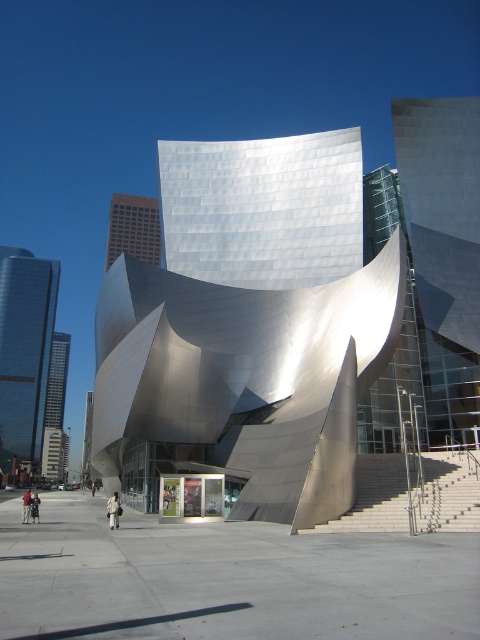
You are a photographer standing in the plaza and want to capture both the light brown leather jacket at center and the dark gray fabric jacket at lower left in the same frame. Which jacket should you position closer to the left side of your camera viewfinder to include both?

To include both jackets in the frame, position the light brown leather jacket at center closer to the left side of your camera viewfinder since it is already to the left of the dark gray fabric jacket at lower left.

You are standing at the plaza in front of the building and want to reach the entrance located at point (110, 520). There is an obstacle at point (43, 310). Will you have to go around the obstacle to reach the entrance?

Point (43, 310) is behind point (110, 520), so you will not encounter the obstacle at point (43, 310) while moving towards the entrance at point (110, 520). You can proceed directly to the entrance without needing to go around.

You are planning to take a photo of the shiny glass skyscraper at left and want to include the dark gray fabric jacket at lower left in the frame. Based on their sizes, will the skyscraper dominate the image?

The shiny glass skyscraper at left is wider than the dark gray fabric jacket at lower left, so yes, the skyscraper will dominate the image.